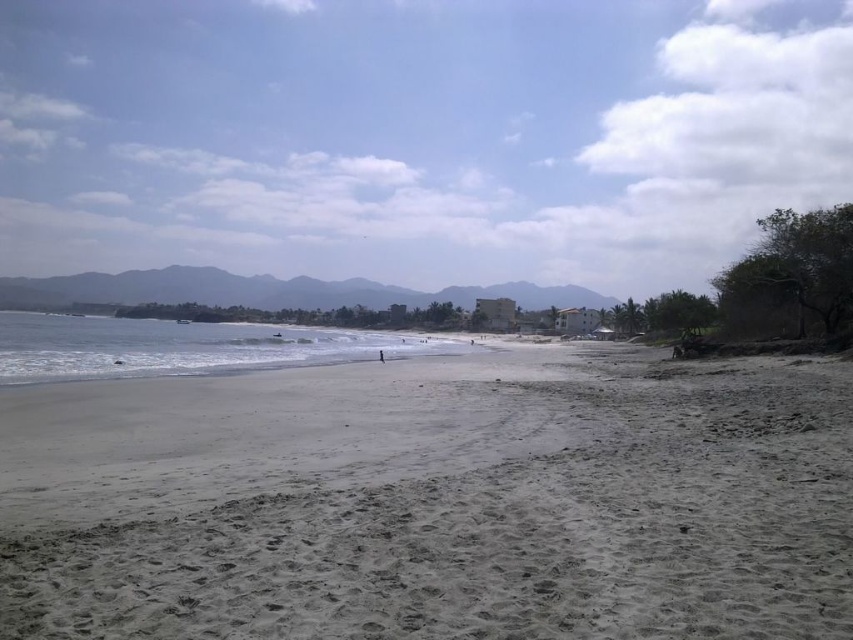
Which is behind, point (502, 365) or point (379, 353)?

Positioned behind is point (379, 353).

Can you confirm if gray sand at center is positioned above skinny person at center?

Incorrect, gray sand at center is not positioned above skinny person at center.

Is point (97, 472) positioned after point (381, 355)?

No, (97, 472) is closer to viewer.

At what (x,y) coordinates should I click in order to perform the action: click on gray sand at center. Please return your answer as a coordinate pair (x, y). This screenshot has width=853, height=640. Looking at the image, I should click on (434, 500).

Which is below, gray sand at center or white sand at lower left?

gray sand at center

Where is `gray sand at center`? This screenshot has height=640, width=853. gray sand at center is located at coordinates (434, 500).

This screenshot has width=853, height=640. What are the coordinates of `gray sand at center` in the screenshot? It's located at (434, 500).

Between white sand at lower left and skinny person at center, which one appears on the right side from the viewer's perspective?

skinny person at center

Where is `white sand at lower left`? white sand at lower left is located at coordinates pyautogui.click(x=183, y=346).

This screenshot has height=640, width=853. What are the coordinates of `white sand at lower left` in the screenshot? It's located at (183, 346).